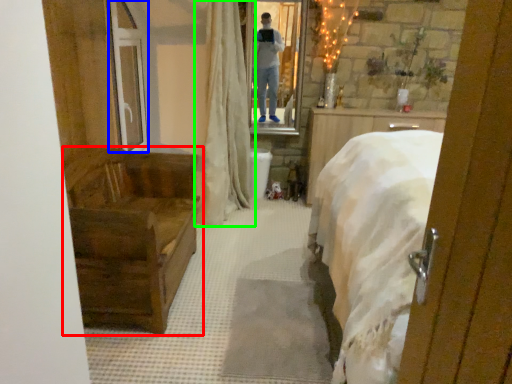
Question: Which is nearer to the furniture (highlighted by a red box)? glass door (highlighted by a blue box) or curtain (highlighted by a green box).

Choices:
 (A) glass door
 (B) curtain

Answer: (A)